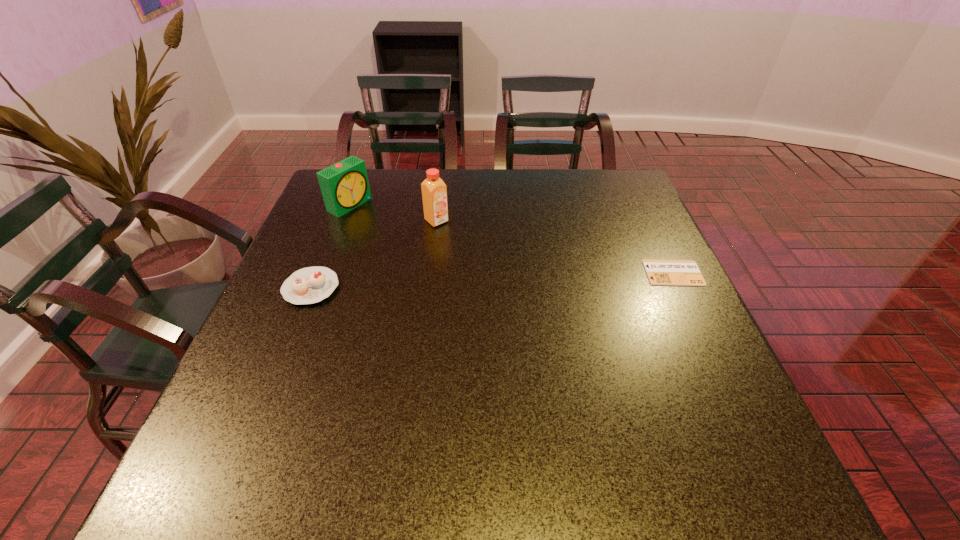
The width and height of the screenshot is (960, 540). Identify the location of the third tallest object. (309, 285).

At what (x,y) coordinates should I click in order to perform the action: click on the shortest object. Please return your answer as a coordinate pair (x, y). The height and width of the screenshot is (540, 960). Looking at the image, I should click on (660, 272).

Where is `the rightmost object`? The height and width of the screenshot is (540, 960). the rightmost object is located at coordinates (660, 272).

Where is `orange juice`? orange juice is located at coordinates (434, 192).

The height and width of the screenshot is (540, 960). I want to click on the tallest object, so click(x=434, y=192).

Identify the location of the third shortest object. This screenshot has width=960, height=540. (344, 185).

Locate an element on the screen. free point located 0.170m on the right of the second shortest object is located at coordinates (411, 288).

The height and width of the screenshot is (540, 960). Identify the location of free spot located on the front of the rightmost object. pyautogui.click(x=743, y=421).

The image size is (960, 540). Identify the location of vacant space located 0.300m on the front and back of the orange juice. (518, 284).

Identify the location of vacant space located on the front and back of the orange juice. Image resolution: width=960 pixels, height=540 pixels. (496, 267).